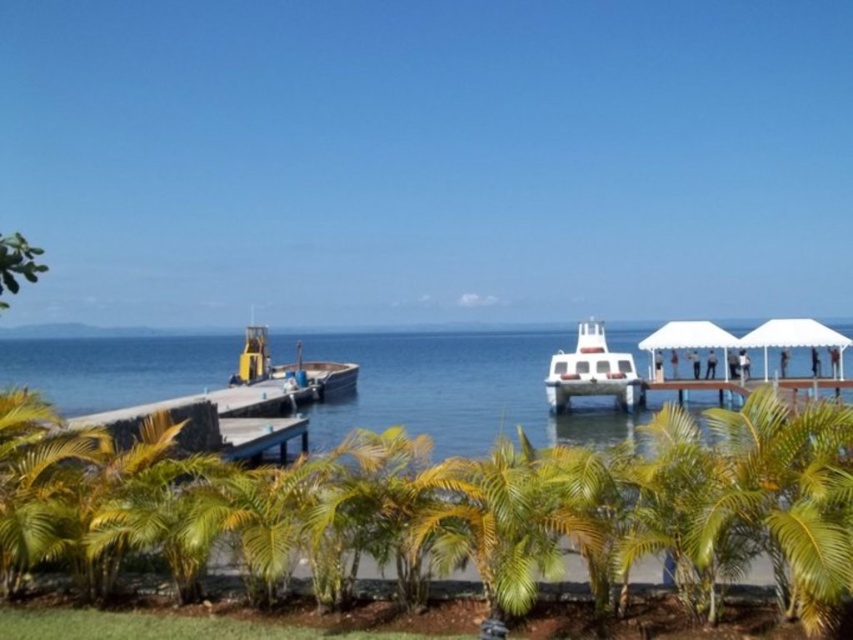
You are standing on the smooth concrete dock at left and want to reach the white glossy boat at center. According to the scene, is the boat directly above the dock?

Yes, the smooth concrete dock at left is positioned under the white glossy boat at center, so the boat is directly above the dock.

You are standing on the white wooden dock at lower right and want to reach the yellow matte boat at lower left. Which direction should you move to get there?

Since the white wooden dock at lower right is behind the yellow matte boat at lower left, you should move forward towards the boat.

You are standing at the edge of the smooth concrete dock at left and want to reach the white glossy boat at center. Which direction should you move to get closer to the boat?

You should move towards the center of the image because the white glossy boat at center is further away from you than the smooth concrete dock at left, so moving towards the center will bring you closer to the boat.